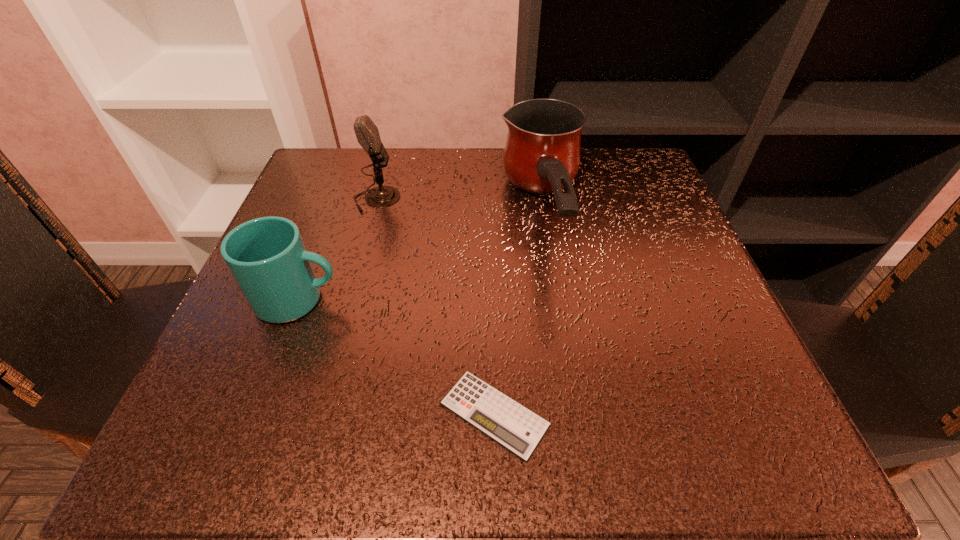
Where is `saucepan that is at the far edge`? The width and height of the screenshot is (960, 540). saucepan that is at the far edge is located at coordinates (x=542, y=154).

You are a GUI agent. You are given a task and a screenshot of the screen. Output one action in this format:
    pyautogui.click(x=<x>, y=<y>)
    Task: Click on the object positioned at the near edge
    The image size is (960, 540).
    Given the screenshot: What is the action you would take?
    pyautogui.click(x=516, y=428)

The width and height of the screenshot is (960, 540). Find the location of `microphone that is at the left edge`. microphone that is at the left edge is located at coordinates (367, 134).

In order to click on cup located at the left edge in this screenshot , I will do `click(267, 257)`.

The width and height of the screenshot is (960, 540). I want to click on object that is at the far left corner, so pyautogui.click(x=367, y=134).

This screenshot has height=540, width=960. What are the coordinates of `vacant space at the far edge` in the screenshot? It's located at (483, 174).

This screenshot has height=540, width=960. What are the coordinates of `vacant region at the near edge of the desktop` in the screenshot? It's located at (345, 406).

In the image, there is a desktop. At what (x,y) coordinates should I click in order to perform the action: click on vacant space at the left edge. Please return your answer as a coordinate pair (x, y). The image size is (960, 540). Looking at the image, I should click on (331, 239).

The height and width of the screenshot is (540, 960). Identify the location of vacant space at the right edge. (671, 226).

The width and height of the screenshot is (960, 540). In order to click on vacant space at the near left corner of the desktop in this screenshot , I will do `click(233, 449)`.